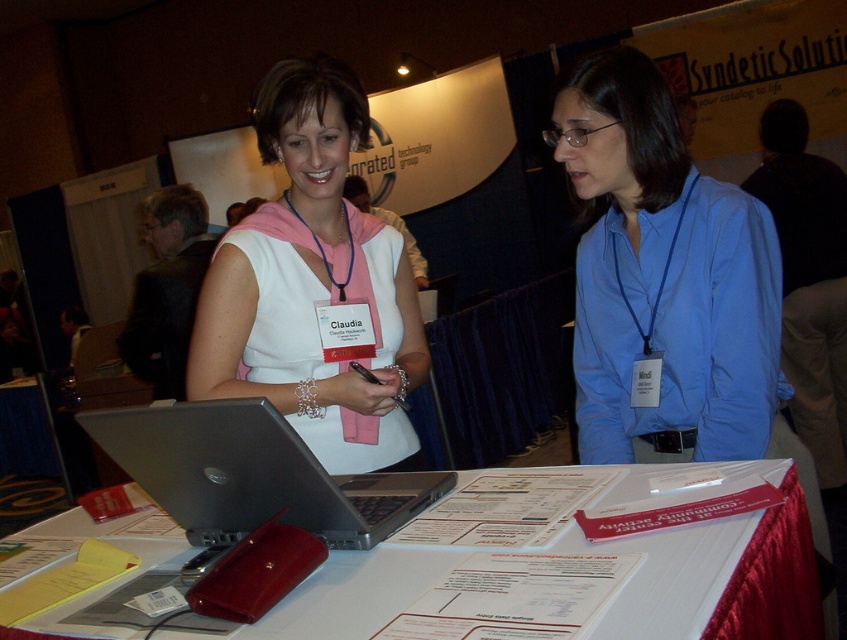
Question: Considering the real-world distances, which object is closest to the white paper at center?

Choices:
 (A) black suit jacket at left
 (B) white matte vest at center
 (C) silver metallic laptop at center

Answer: (C)

Question: Does blue shirt at center appear on the right side of silver metallic laptop at center?

Choices:
 (A) no
 (B) yes

Answer: (B)

Question: Which point is closer to the camera?

Choices:
 (A) black suit jacket at left
 (B) pink fabric scarf at upper center
 (C) blue shirt at center
 (D) white matte vest at center

Answer: (D)

Question: Which point is closer to the camera taking this photo?

Choices:
 (A) (344, 184)
 (B) (187, 243)
 (C) (690, 612)
 (D) (299, 332)

Answer: (C)

Question: Does white matte vest at center come behind black suit jacket at left?

Choices:
 (A) yes
 (B) no

Answer: (B)

Question: Can you confirm if silver metallic laptop at center is positioned below pink fabric scarf at upper center?

Choices:
 (A) yes
 (B) no

Answer: (A)